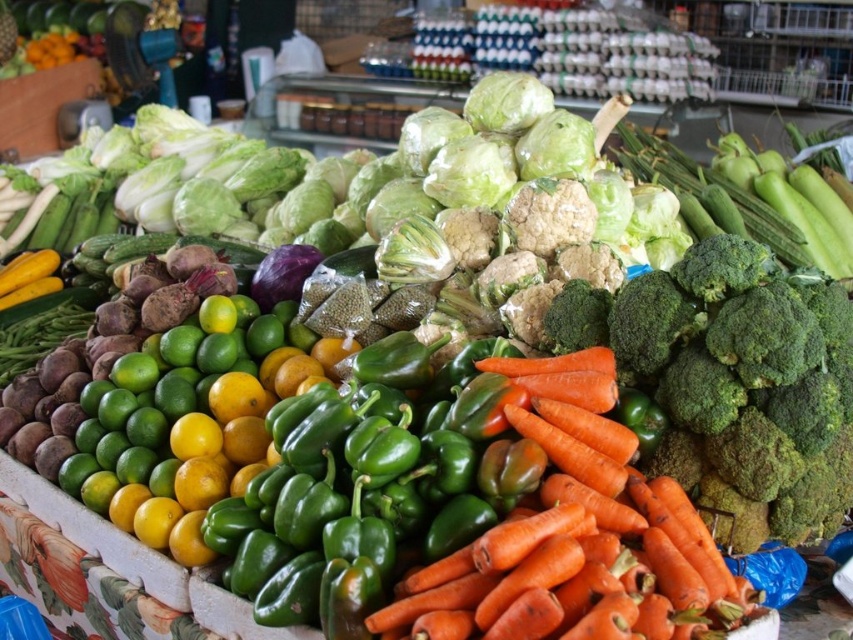
Question: Which object is farther from the camera taking this photo?

Choices:
 (A) green matte broccoli at right
 (B) green broccoli at center

Answer: (B)

Question: Is orange rough carrots at center thinner than green broccoli at center?

Choices:
 (A) no
 (B) yes

Answer: (A)

Question: Is orange rough carrots at center wider than green matte broccoli at right?

Choices:
 (A) no
 (B) yes

Answer: (B)

Question: Which object appears farthest from the camera in this image?

Choices:
 (A) orange rough carrots at center
 (B) green broccoli at center
 (C) green matte broccoli at right

Answer: (B)

Question: Which object appears farthest from the camera in this image?

Choices:
 (A) green matte broccoli at right
 (B) green broccoli at center
 (C) orange rough carrots at center

Answer: (B)

Question: Can you confirm if orange rough carrots at center is bigger than green matte broccoli at right?

Choices:
 (A) yes
 (B) no

Answer: (A)